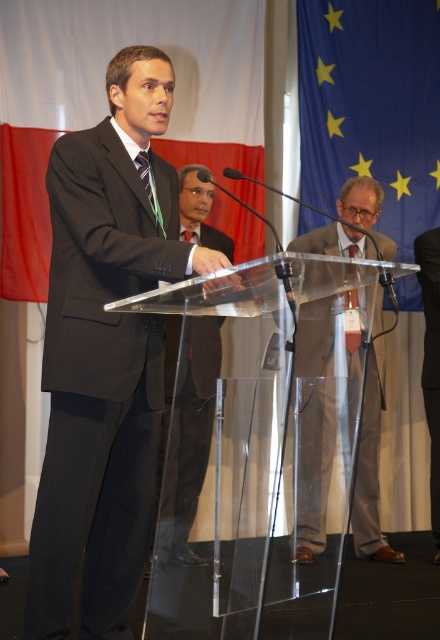
You are a photographer at the event and need to capture a photo of both the black matte suit at left and the black matte suit at center. Based on their positions, which one is positioned further to the left in the image?

The black matte suit at left is positioned to the left of the black matte suit at center, so the black matte suit at left is further to the left in the image.